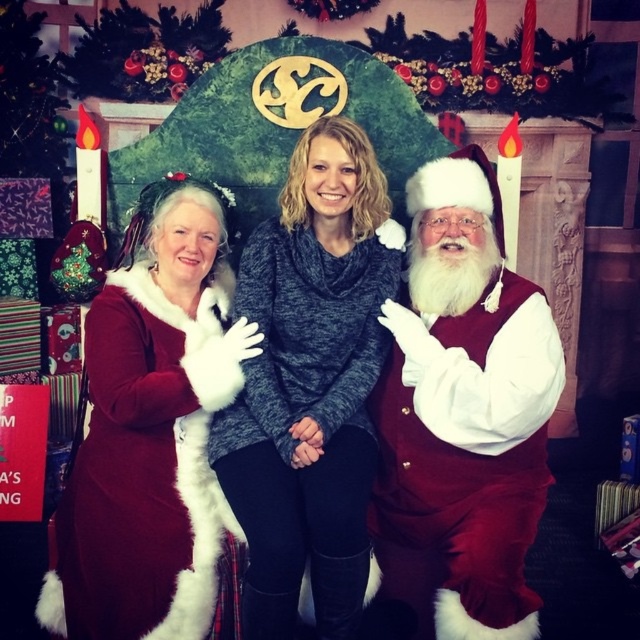
Question: Can you confirm if fuzzy red dress at center is positioned below velvet red coat at center?

Choices:
 (A) no
 (B) yes

Answer: (A)

Question: Which point appears closest to the camera in this image?

Choices:
 (A) (449, 230)
 (B) (483, 289)

Answer: (A)

Question: Is fuzzy red dress at center smaller than gray sweater at center?

Choices:
 (A) no
 (B) yes

Answer: (A)

Question: Estimate the real-world distances between objects in this image. Which object is closer to the white fluffy santa at right?

Choices:
 (A) gray sweater at center
 (B) fuzzy red dress at center

Answer: (B)

Question: Is gray sweater at center smaller than velvet red coat at center?

Choices:
 (A) no
 (B) yes

Answer: (B)

Question: Based on their relative distances, which object is nearer to the gray sweater at center?

Choices:
 (A) fuzzy red dress at center
 (B) white fluffy santa at right

Answer: (A)